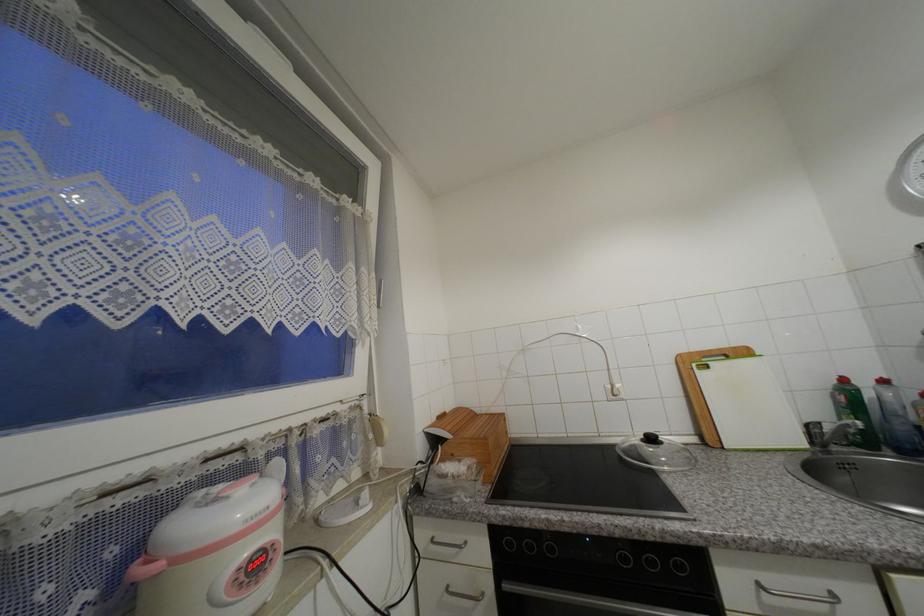
Locate an element on the screen. white cabinet handle is located at coordinates (805, 596).